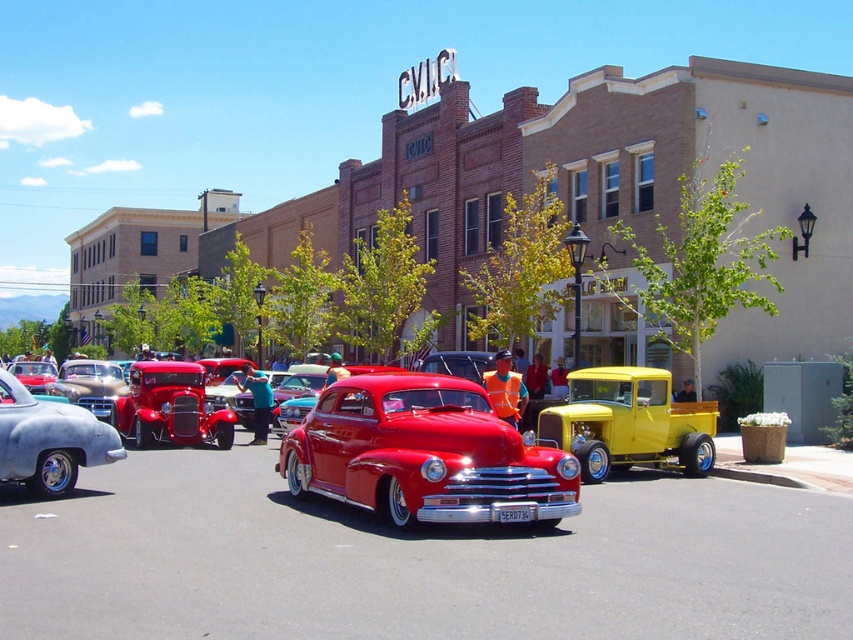
Which is below, glossy metal car at center or yellow wood pickup truck at center?

glossy metal car at center is below.

Can you confirm if glossy metal car at center is thinner than yellow wood pickup truck at center?

Yes, glossy metal car at center is thinner than yellow wood pickup truck at center.

Image resolution: width=853 pixels, height=640 pixels. Describe the element at coordinates (426, 454) in the screenshot. I see `glossy metal car at center` at that location.

This screenshot has height=640, width=853. In order to click on glossy metal car at center in this screenshot , I will do `click(426, 454)`.

Does shiny red car at center have a greater width compared to matte silver car at lower left?

Yes.

I want to click on shiny red car at center, so click(x=424, y=454).

Is yellow wood pickup truck at center bigger than matte silver car at lower left?

Indeed, yellow wood pickup truck at center has a larger size compared to matte silver car at lower left.

Does yellow wood pickup truck at center have a greater height compared to matte silver car at lower left?

Yes, yellow wood pickup truck at center is taller than matte silver car at lower left.

This screenshot has height=640, width=853. What do you see at coordinates (628, 422) in the screenshot?
I see `yellow wood pickup truck at center` at bounding box center [628, 422].

The image size is (853, 640). I want to click on yellow wood pickup truck at center, so click(628, 422).